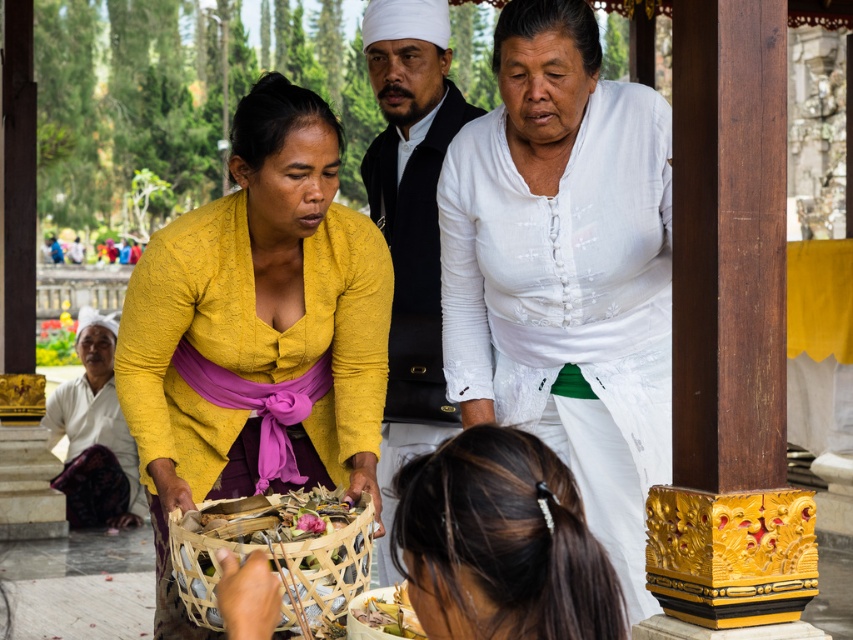
You are a photographer trying to capture both the matte black jacket at center and the purple silk robe at lower left in a single frame. Given their sizes, which object should you focus on to ensure both are clearly visible in the photo?

The matte black jacket at center is smaller than the purple silk robe at lower left, so focusing on the matte black jacket at center while adjusting the camera angle to include the purple silk robe at lower left would ensure both are visible.